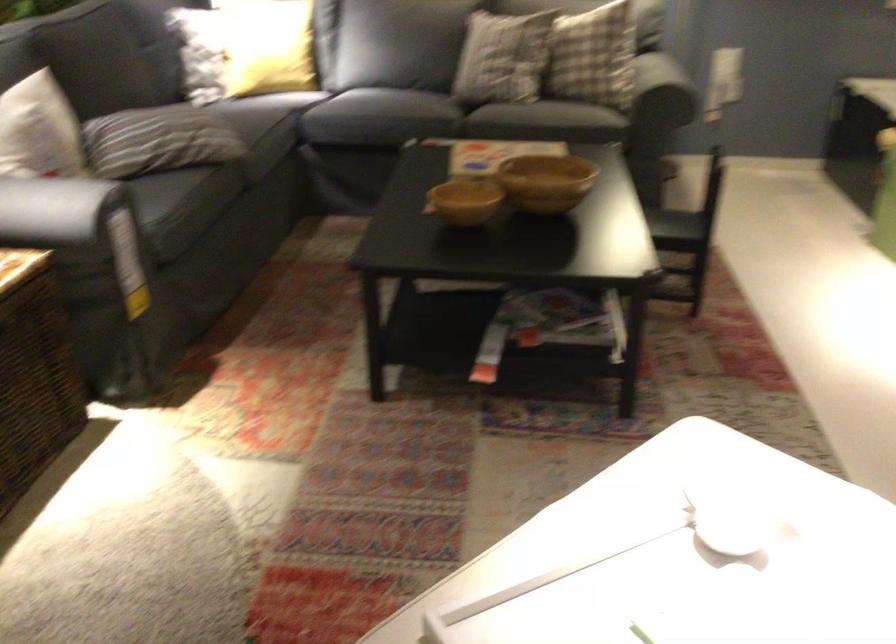
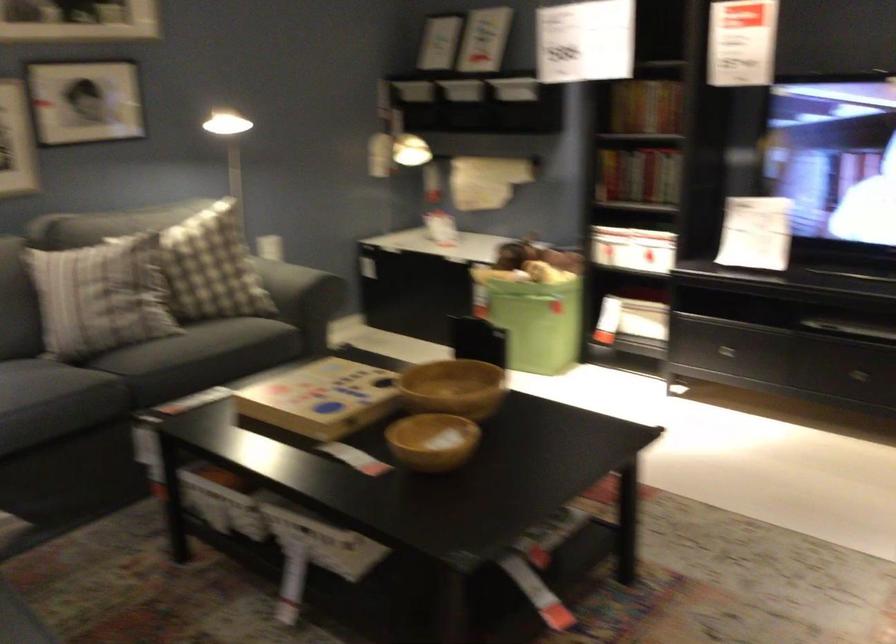
In the second image, find the point that corresponds to (479,204) in the first image.

(433, 440)